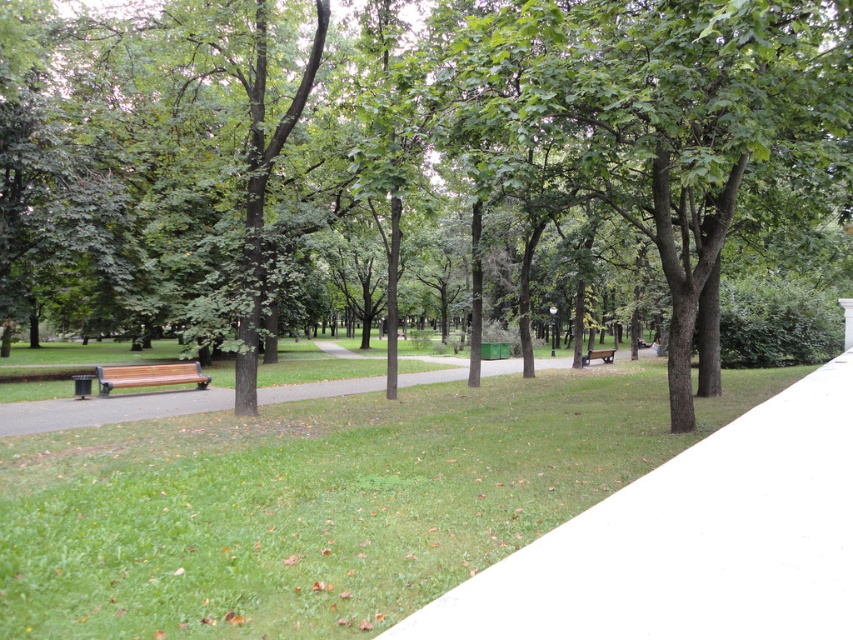
You are a gardener planning to plant a new tree in the park. The existing green leafy tree at center currently shades the white smooth pavement at center. If you want to avoid casting additional shade on the pavement, where should you plant the new tree?

The green leafy tree at center is already positioned over the white smooth pavement at center. To avoid casting more shade on the pavement, plant the new tree away from the area directly above the white smooth pavement at center.

You are a person sitting on the wooden bench at center. You want to step onto the white smooth pavement at center. Is the pavement below or above the bench?

The white smooth pavement at center is below the wooden bench at center, so you can step down onto it.

You are planning to take a nap in the park. You see the green leafy tree at center and the wooden bench at left. Which object would provide more shade if you want to lie down?

The green leafy tree at center has a larger size compared to the wooden bench at left, so it would provide more shade for napping.